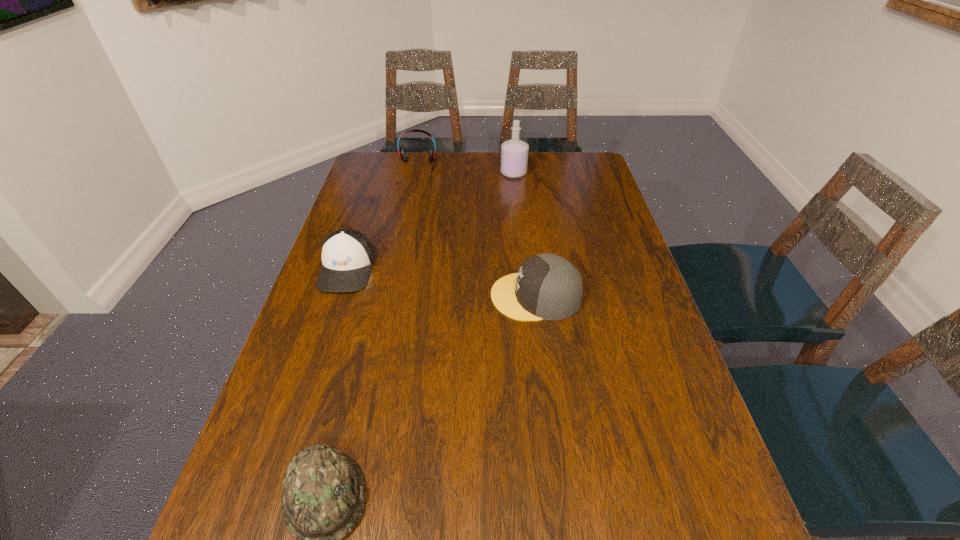
Choose which object is the nearest neighbor to the nearest object. Please provide its 2D coordinates. Your answer should be formatted as a tuple, i.e. [(x, y)], where the tuple contains the x and y coordinates of a point satisfying the conditions above.

[(548, 287)]

Select which headwear appears as the third closest to the headset. Please provide its 2D coordinates. Your answer should be formatted as a tuple, i.e. [(x, y)], where the tuple contains the x and y coordinates of a point satisfying the conditions above.

[(323, 495)]

Choose which headwear is the nearest neighbor to the perfume. Please provide its 2D coordinates. Your answer should be formatted as a tuple, i.e. [(x, y)], where the tuple contains the x and y coordinates of a point satisfying the conditions above.

[(548, 287)]